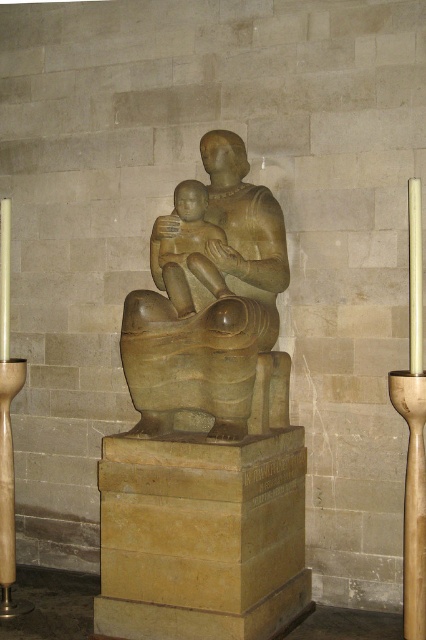
Question: Which point is closer to the camera?

Choices:
 (A) (204, 348)
 (B) (183, 189)
 (C) (304, 493)

Answer: (A)

Question: Is matte stone statue at center bigger than wooden candle holder at lower left?

Choices:
 (A) no
 (B) yes

Answer: (B)

Question: Is matte stone statue at center thinner than matte bronze statue at center?

Choices:
 (A) yes
 (B) no

Answer: (B)

Question: Which point is farther to the camera?

Choices:
 (A) matte bronze statue at center
 (B) wooden candlestick at right
 (C) matte stone statue at center

Answer: (A)

Question: Is matte stone statue at center to the left of matte bronze statue at center from the viewer's perspective?

Choices:
 (A) yes
 (B) no

Answer: (B)

Question: Based on their relative distances, which object is farther from the yellow stone pedestal at center?

Choices:
 (A) matte stone statue at center
 (B) wooden candle holder at lower left
 (C) wooden candlestick at right

Answer: (B)